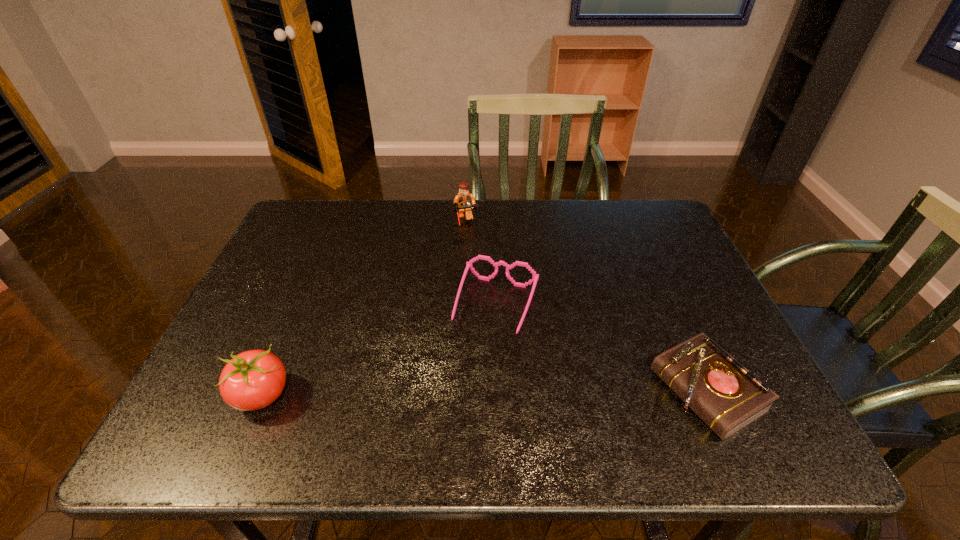
The width and height of the screenshot is (960, 540). In order to click on free space that is in between the spectacles and the farthest object in this screenshot , I will do `click(479, 265)`.

Where is `vacant area between the spectacles and the Lego`? Image resolution: width=960 pixels, height=540 pixels. vacant area between the spectacles and the Lego is located at coordinates (479, 265).

What are the coordinates of `empty space that is in between the rightmost object and the Lego` in the screenshot? It's located at (585, 307).

Locate an element on the screen. free area in between the tomato and the Lego is located at coordinates (363, 309).

What are the coordinates of `free space that is in between the spectacles and the farthest object` in the screenshot? It's located at (479, 265).

I want to click on the closest object to the second farthest object, so click(x=464, y=202).

Find the location of a particular element. Image resolution: width=960 pixels, height=540 pixels. object that is the second closest one to the farthest object is located at coordinates (722, 392).

Find the location of a particular element. This screenshot has width=960, height=540. free location that satisfies the following two spatial constraints: 1. on the front side of the second farthest object; 2. on the left side of the rightmost object is located at coordinates click(x=500, y=391).

Identify the location of vacant region that satisfies the following two spatial constraints: 1. on the back side of the Lego; 2. on the right side of the leftmost object. The image size is (960, 540). coord(335,224).